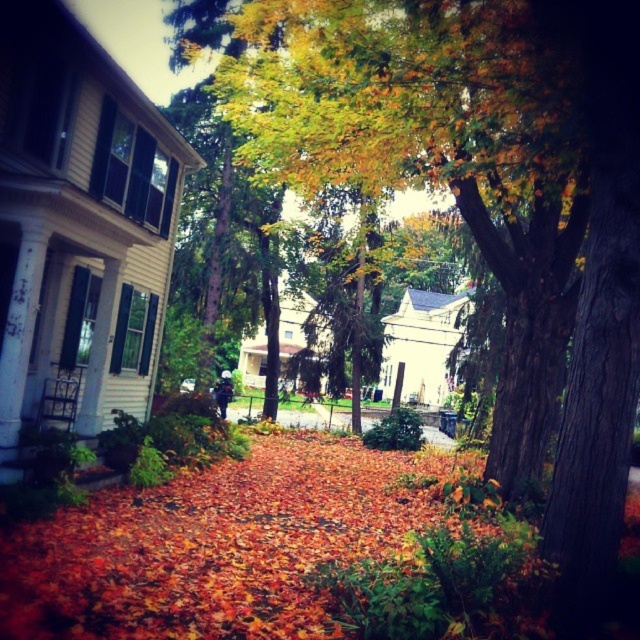
You are a gardener who needs to place a new bench in the center of the pathway. The bench is 1.5 meters wide. Considering the green leafy tree at center and autumn leaves at center, which object would you need to avoid placing the bench over to ensure it fits properly?

The green leafy tree at center might be wider than autumn leaves at center, so you should avoid placing the bench over the green leafy tree at center to ensure it fits within the available space.

Looking at this image, you are standing on the pathway covered in autumn leaves and want to take a photo of the green leafy tree at center and autumn leaves at center. Which object will appear larger in the photo?

The green leafy tree at center will appear larger in the photo because it is taller than the autumn leaves at center.